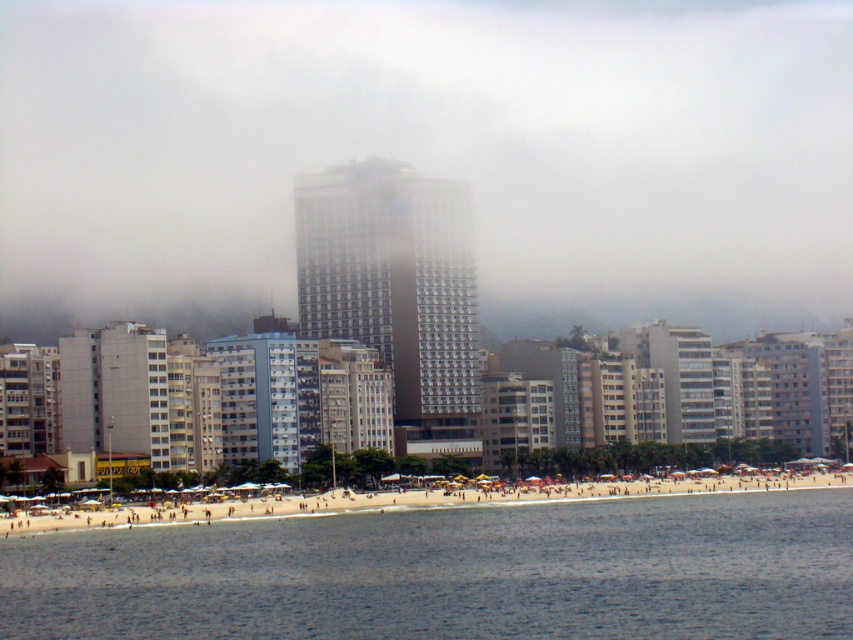
Question: Does transparent fog at center have a greater width compared to clear blue water at beach center?

Choices:
 (A) yes
 (B) no

Answer: (A)

Question: Does transparent fog at center appear over clear blue water at beach center?

Choices:
 (A) no
 (B) yes

Answer: (B)

Question: Which of the following is the closest to the observer?

Choices:
 (A) clear blue water at beach center
 (B) beige sand beach at lower center

Answer: (A)

Question: Which of the following is the closest to the observer?

Choices:
 (A) (682, 582)
 (B) (216, 513)

Answer: (A)

Question: Based on their relative distances, which object is farther from the transparent fog at center?

Choices:
 (A) beige sand beach at lower center
 (B) clear blue water at beach center

Answer: (A)

Question: Is transparent fog at center positioned before beige sand beach at lower center?

Choices:
 (A) yes
 (B) no

Answer: (B)